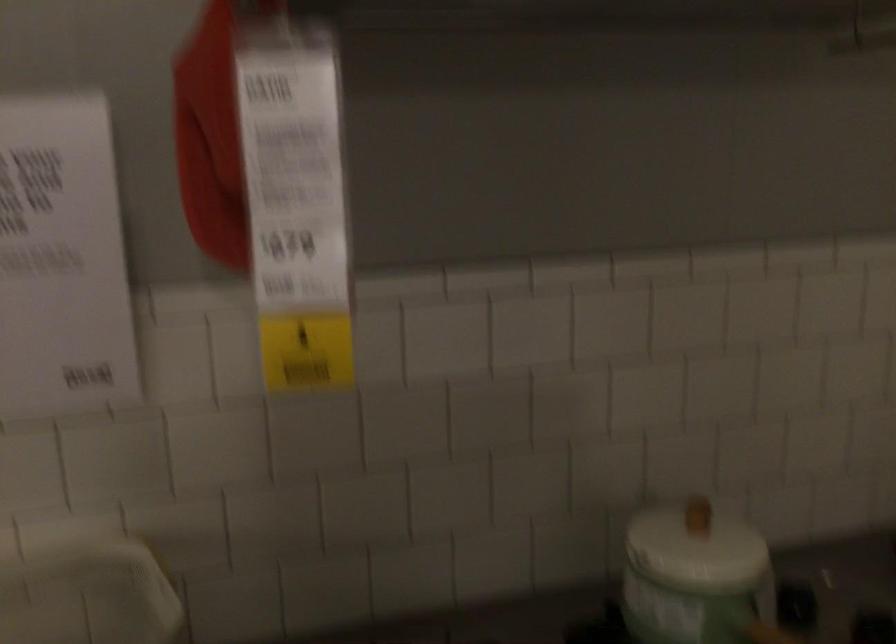
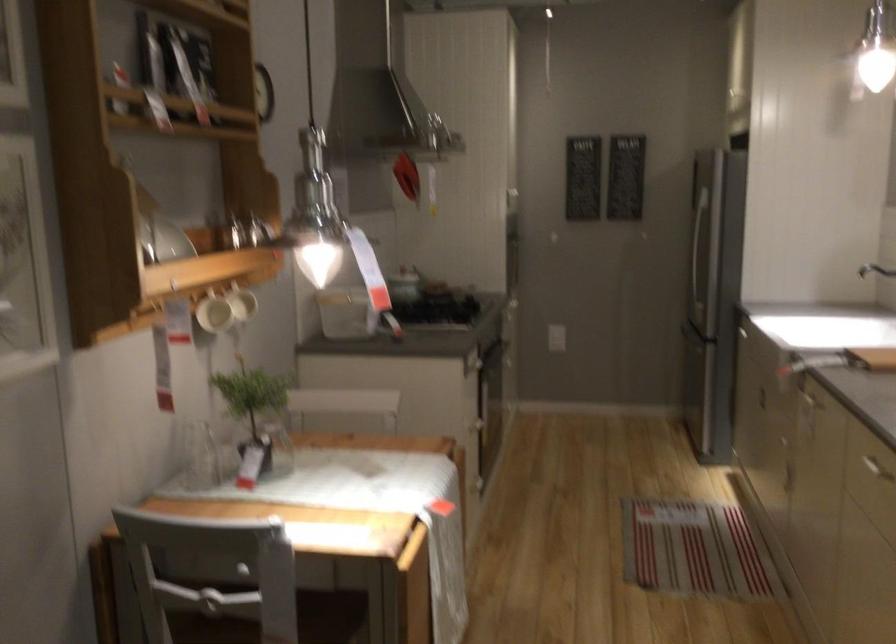
Question: I am providing you with two images of the same scene from different viewpoints. After the viewpoint changes to image2, which objects are now occluded?

Choices:
 (A) sink faucet handle
 (B) white canister lid
 (C) red button panel
 (D) cabinet drawer handle

Answer: (B)